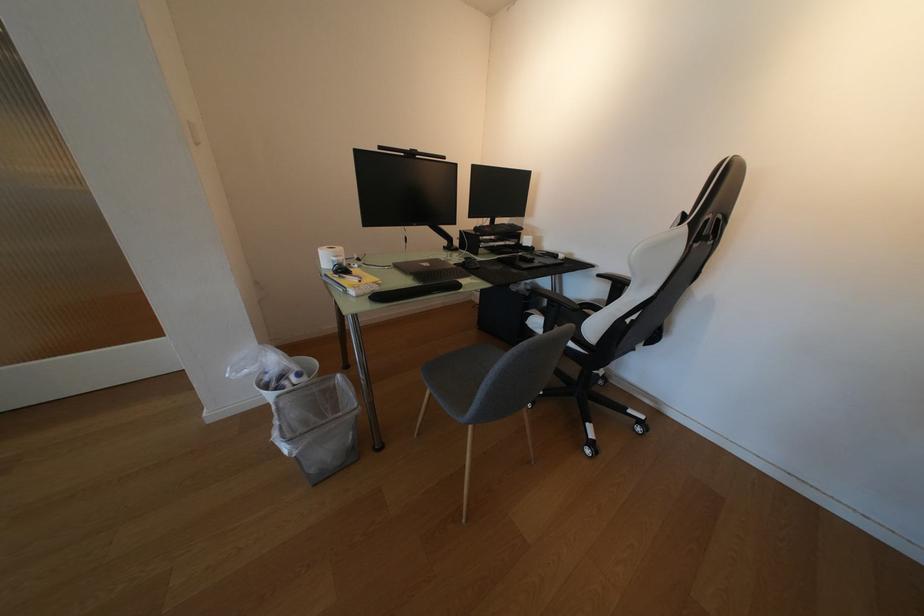
The location [317,426] corresponds to which object?

It refers to a small white bin.